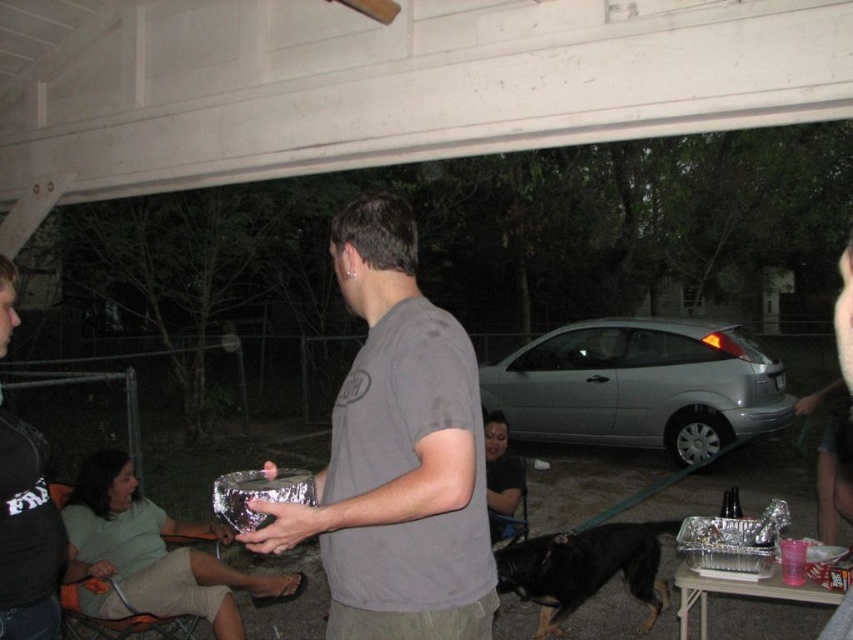
Locate an element on the screen. This screenshot has width=853, height=640. silver metallic car at center is located at coordinates (640, 387).

What do you see at coordinates (640, 387) in the screenshot?
I see `silver metallic car at center` at bounding box center [640, 387].

Locate an element on the screen. This screenshot has width=853, height=640. silver metallic car at center is located at coordinates tap(640, 387).

Who is higher up, gray matte t-shirt at center or black fur dog at lower center?

gray matte t-shirt at center

Does gray matte t-shirt at center lie behind black fur dog at lower center?

That is False.

Which is behind, point (386, 320) or point (590, 541)?

The point (590, 541) is behind.

The image size is (853, 640). Identify the location of gray matte t-shirt at center. (397, 454).

Can you confirm if gray matte t-shirt at center is positioned to the left of silver metallic car at center?

Indeed, gray matte t-shirt at center is positioned on the left side of silver metallic car at center.

Who is more distant from viewer, (473, 499) or (561, 344)?

Positioned behind is point (561, 344).

Where is `gray matte t-shirt at center`? This screenshot has height=640, width=853. gray matte t-shirt at center is located at coordinates (397, 454).

The height and width of the screenshot is (640, 853). What are the coordinates of `gray matte t-shirt at center` in the screenshot? It's located at (397, 454).